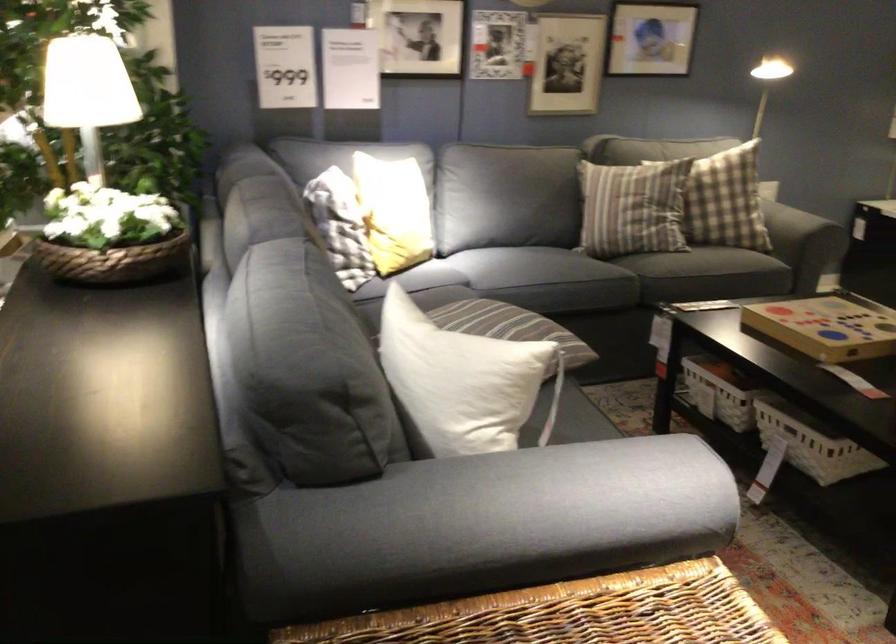
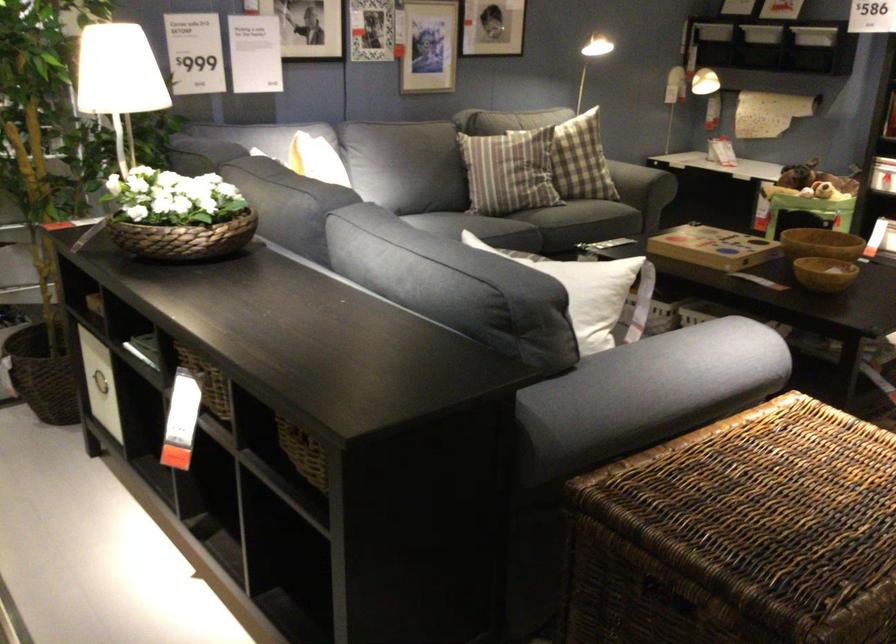
In the second image, find the point that corresponds to [88,227] in the first image.

(177, 216)